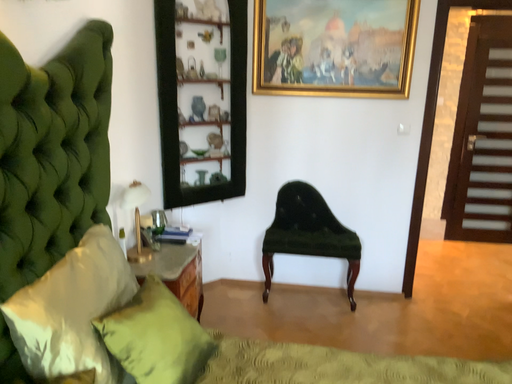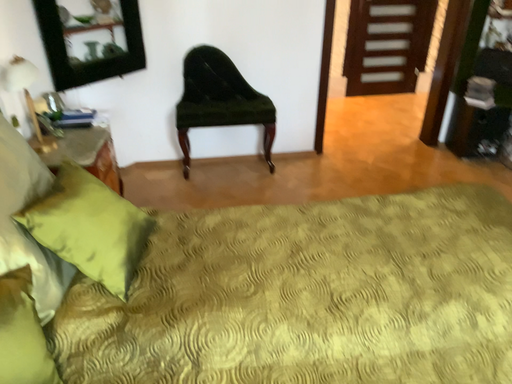
Question: How did the camera likely rotate when shooting the video?

Choices:
 (A) rotated upward
 (B) rotated downward

Answer: (B)